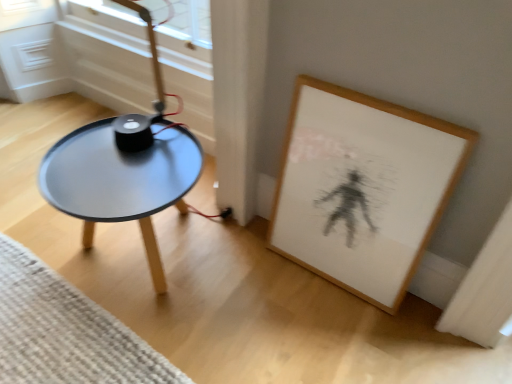
Question: From a real-world perspective, is matte black table at left located higher than wooden framed artwork at lower right?

Choices:
 (A) yes
 (B) no

Answer: (B)

Question: Does matte black table at left have a greater width compared to wooden framed artwork at lower right?

Choices:
 (A) no
 (B) yes

Answer: (B)

Question: Is wooden framed artwork at lower right at the back of matte black table at left?

Choices:
 (A) yes
 (B) no

Answer: (B)

Question: Is matte black table at left at the right side of wooden framed artwork at lower right?

Choices:
 (A) no
 (B) yes

Answer: (A)

Question: From a real-world perspective, is matte black table at left under wooden framed artwork at lower right?

Choices:
 (A) yes
 (B) no

Answer: (A)

Question: Does matte black table at left have a greater height compared to wooden framed artwork at lower right?

Choices:
 (A) no
 (B) yes

Answer: (A)

Question: Does matte black table at left have a greater height compared to woven beige mat at lower left?

Choices:
 (A) no
 (B) yes

Answer: (B)

Question: Can you see matte black table at left touching woven beige mat at lower left?

Choices:
 (A) yes
 (B) no

Answer: (B)

Question: Does matte black table at left have a larger size compared to woven beige mat at lower left?

Choices:
 (A) no
 (B) yes

Answer: (B)

Question: Is matte black table at left surrounding woven beige mat at lower left?

Choices:
 (A) yes
 (B) no

Answer: (B)

Question: Is matte black table at left not within woven beige mat at lower left?

Choices:
 (A) no
 (B) yes

Answer: (B)

Question: Considering the relative sizes of matte black table at left and woven beige mat at lower left in the image provided, is matte black table at left thinner than woven beige mat at lower left?

Choices:
 (A) no
 (B) yes

Answer: (B)

Question: From a real-world perspective, is wooden framed artwork at lower right on matte black table at left?

Choices:
 (A) no
 (B) yes

Answer: (B)